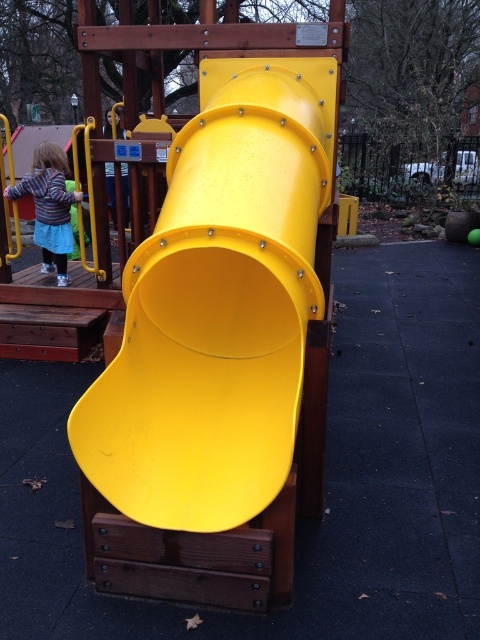
You are standing at the playground looking at the yellow tunnel slide. There are two points marked on the slide, one at coordinates point (147, 509) and the other at point (48, 150). Which of these points is closer to your viewpoint?

Point (147, 509) is closer to the camera than point (48, 150), so the point at coordinates point (147, 509) is closer to your viewpoint.

You are standing at the point labeled as point [192,497] in the playground. You want to retrieve a lost toy that is exactly 2.5 meters away from you. Can you reach it without moving?

The distance between you and the viewer is 2.30 meters. Since the toy is 2.5 meters away, which is farther than 2.30 meters, you cannot reach it without moving.